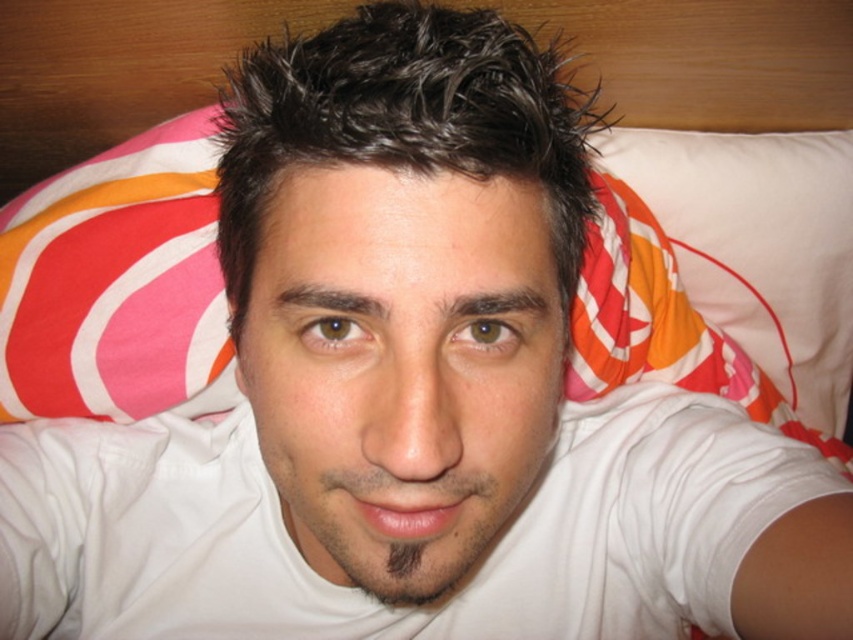
Is white matte head at center positioned in front of white cotton shirt at center?

That is True.

From the picture: Can you confirm if white matte head at center is bigger than white cotton shirt at center?

No, white matte head at center is not bigger than white cotton shirt at center.

Who is more distant from viewer, (399,412) or (259,637)?

The point (259,637) is behind.

At what (x,y) coordinates should I click in order to perform the action: click on white matte head at center. Please return your answer as a coordinate pair (x, y). The height and width of the screenshot is (640, 853). Looking at the image, I should click on (402, 284).